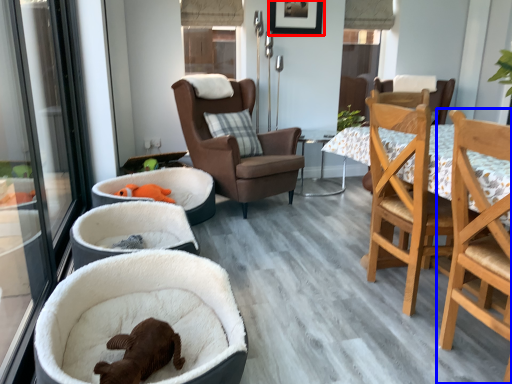
Question: Which of the following is the farthest to the observer, picture frame (highlighted by a red box) or chair (highlighted by a blue box)?

Choices:
 (A) picture frame
 (B) chair

Answer: (A)